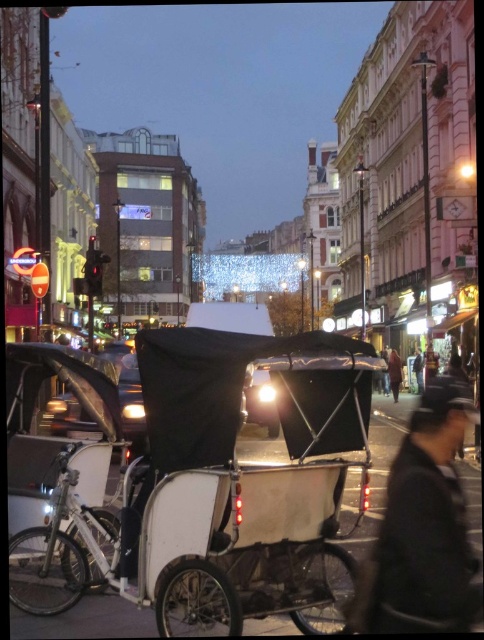
You are a delivery person who needs to load a large package into either the black matte coach at center or the dark gray coat at center. Which one can accommodate the package based on their sizes?

The black matte coach at center is larger in size than the dark gray coat at center, so the large package can be accommodated in the black matte coach at center.

Based on the photo, you are a tourist standing on the street and see the white matte rickshaw at center and the dark gray coat at center. Which object is closer to the ground?

The white matte rickshaw at center is closer to the ground because it is below the dark gray coat at center.

Looking at this image, you are standing at the point labeled point (419, 372) and want to walk to the point labeled point (259, 604). Which direction should you face to walk straight towards your destination?

You should face the direction towards point (259, 604), which is in front of point (419, 372).